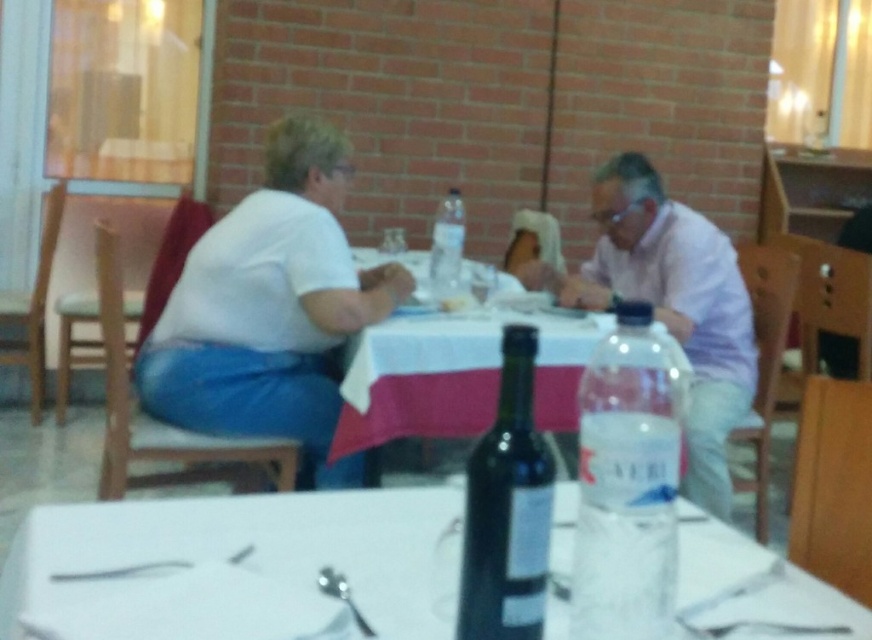
From the picture: You are a waiter in a restaurant and need to determine which clear plastic bottle is wider. You see both the clear plastic bottle at right and the clear plastic bottle at center on a table. Which one has a greater width?

The clear plastic bottle at right has a greater width than the clear plastic bottle at center.